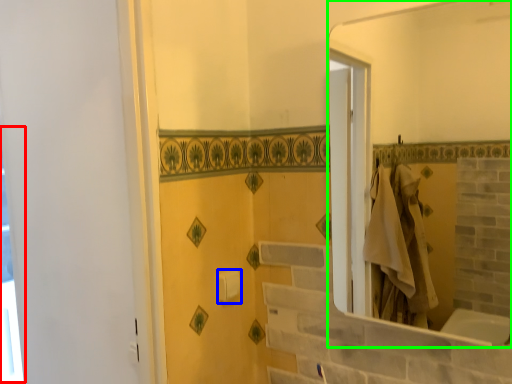
Question: Which object is positioned closest to window (highlighted by a red box)? Select from towel bar (highlighted by a blue box) and mirror (highlighted by a green box).

Choices:
 (A) towel bar
 (B) mirror

Answer: (A)